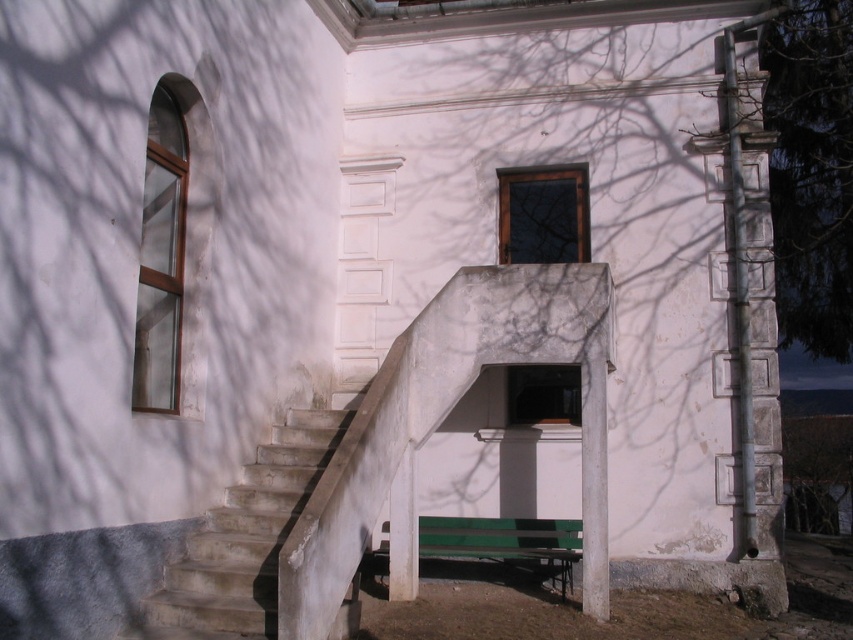
Based on the photo, you are a painter who needs to decide which object to paint first between the green textured stone column at right and the clear glass window at left. Since you want to paint the wider object first, which one should you choose?

The clear glass window at left is wider than the green textured stone column at right, so you should paint the clear glass window at left first.

You are a delivery person trying to deliver a package to the building. The package requires a delivery path that must stay at least 5 feet away from both the green textured stone column at right and the clear glass window at left. Is this possible given their current positions?

The green textured stone column at right and clear glass window at left are 44.82 feet apart from each other. Since the required distance from each is 5 feet, the total needed space would be 10 feet. Since 44.82 feet is greater than 10 feet, there is enough space to maintain the required distance between both objects. Therefore, the delivery path can stay at least 5 feet away from both the green textured stone column at right and the clear glass window at left.

You are standing at the base of the building and want to take a photo of the green textured stone column at right and the concrete stairs at center. Which object should you position yourself closer to in order to capture both in a single frame without moving the camera?

You should position yourself closer to the concrete stairs at center because the green textured stone column at right is located to the right of the concrete stairs at center, so moving closer to the stairs will help include both in the frame.